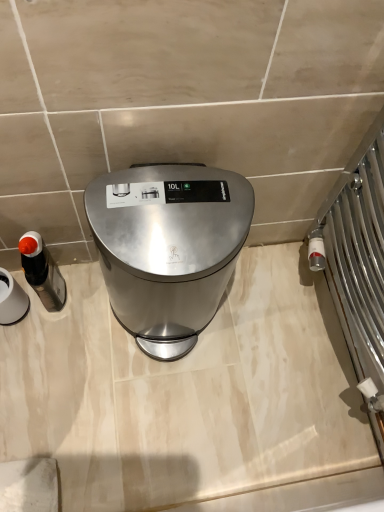
The width and height of the screenshot is (384, 512). I want to click on free space above satin silver trash can at center (from a real-world perspective), so [x=160, y=210].